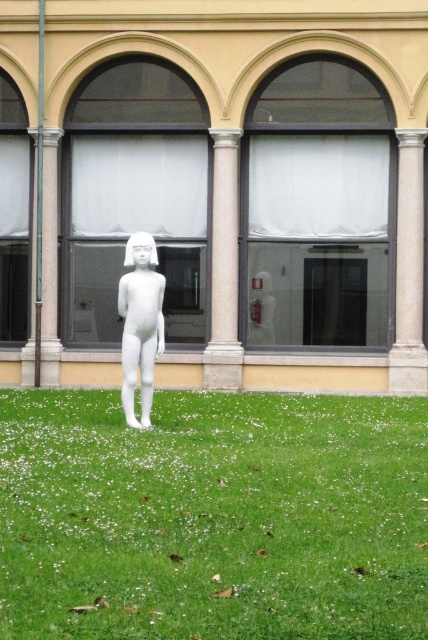
You are an architect inspecting a sculpture garden. You notice two pillars at the center of the garden, the white marble pillar at center and the smooth stone pillar at center. Which pillar is taller?

The smooth stone pillar at center is taller than the white marble pillar at center.

Looking at this image, you are a gardener who needs to water the green grass at center and the white matte sculpture at center. Which object should you water first if you start from the base of the sculpture and move downward?

You should water the green grass at center first because it is located below the white matte sculpture at center, so you would naturally move downward from the sculpture to the grass.